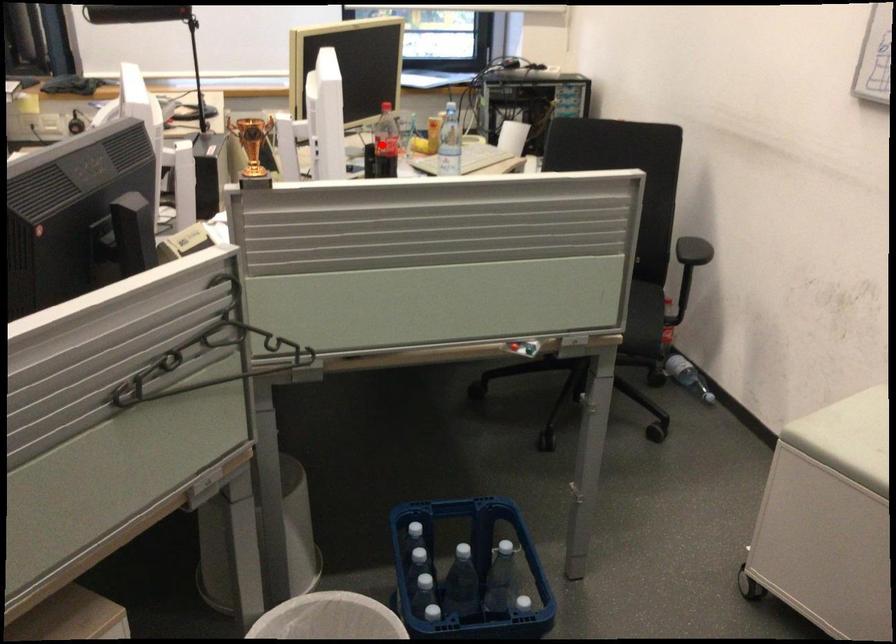
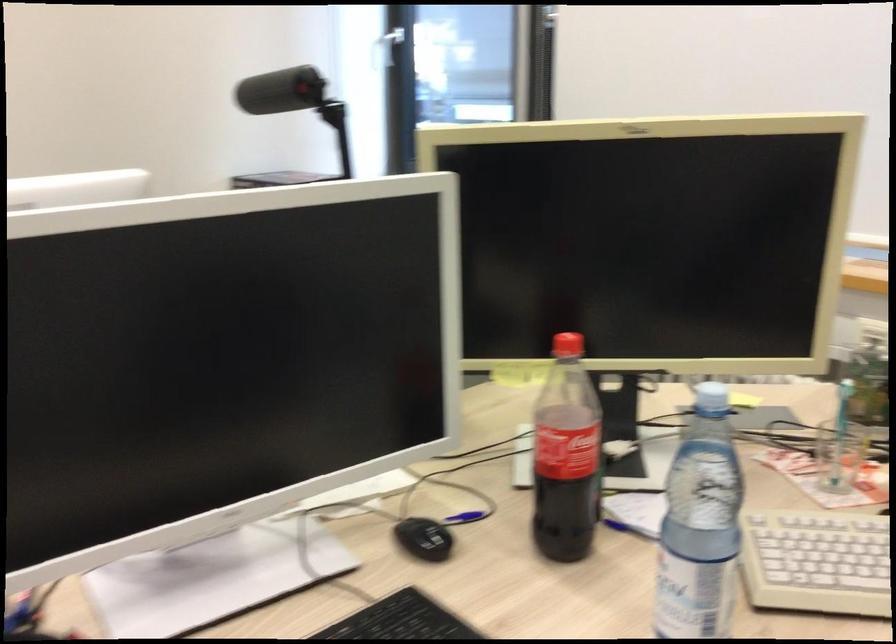
Question: I am providing you with two images of the same scene from different viewpoints. Given a red point in image1, look at the same physical point in image2. Is it:

Choices:
 (A) Closer to the viewpoint
 (B) Farther from the viewpoint

Answer: (A)